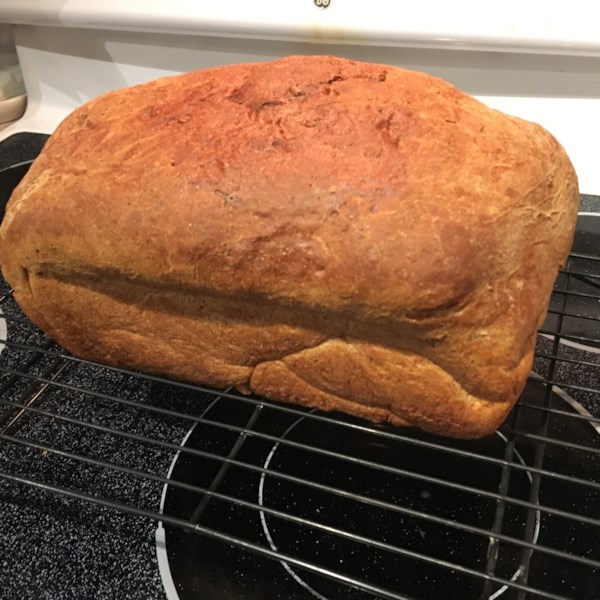
You are a GUI agent. You are given a task and a screenshot of the screen. Output one action in this format:
    pyautogui.click(x=<x>, y=<y>)
    Task: Click on the wire rack
    
    Given the screenshot: What is the action you would take?
    pyautogui.click(x=110, y=500), pyautogui.click(x=146, y=470), pyautogui.click(x=173, y=446), pyautogui.click(x=214, y=425), pyautogui.click(x=573, y=416), pyautogui.click(x=578, y=333), pyautogui.click(x=548, y=393)